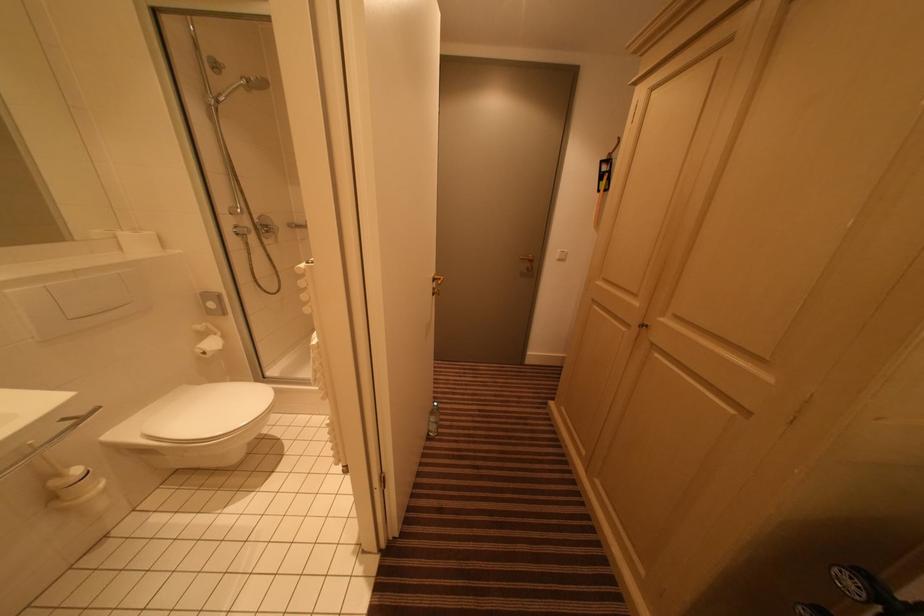
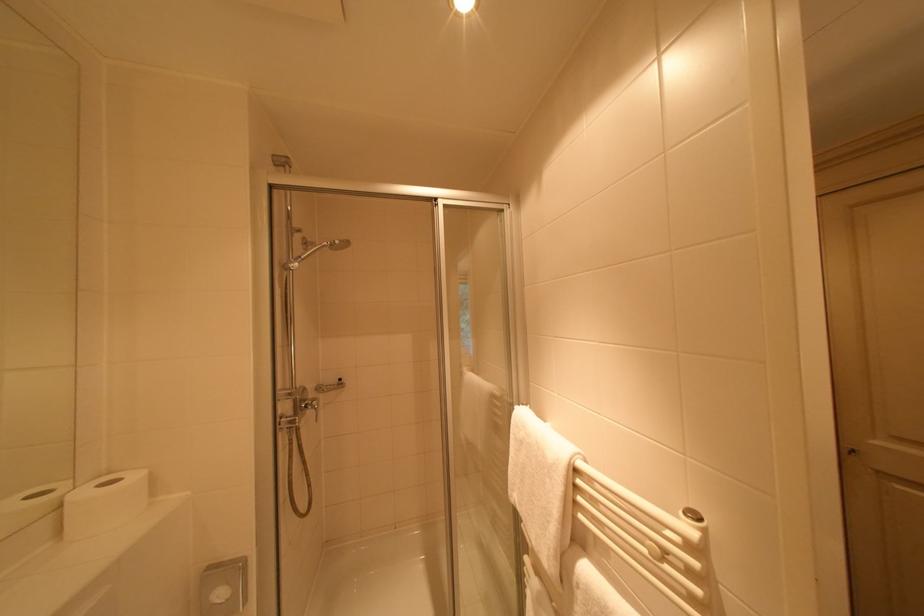
Question: What movement of the cameraman would produce the second image?

Choices:
 (A) Left
 (B) Right
 (C) Forward
 (D) Backward

Answer: (A)